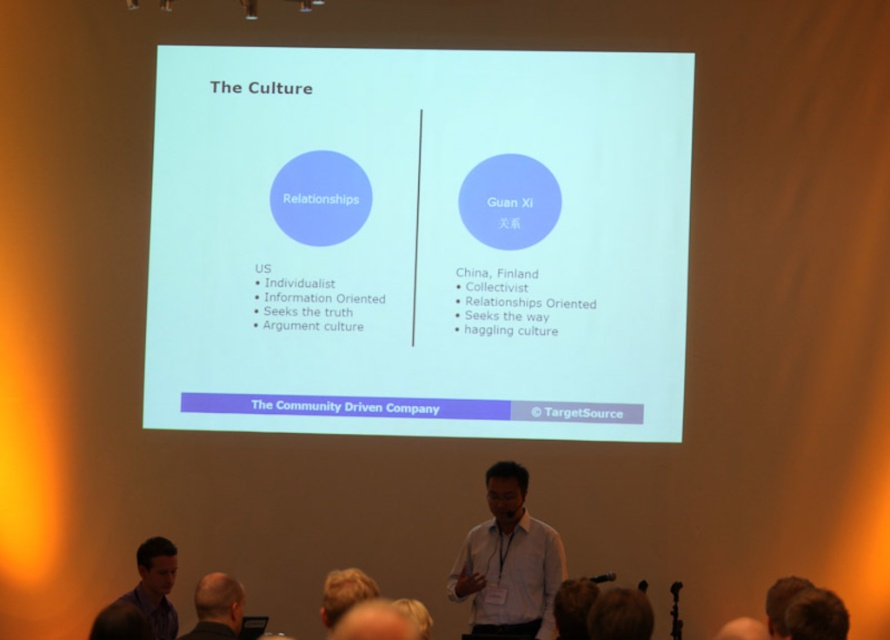
Question: Is white matte shirt at center to the right of dark gray hair at lower center from the viewer's perspective?

Choices:
 (A) yes
 (B) no

Answer: (A)

Question: Which object is farther from the camera taking this photo?

Choices:
 (A) blonde hair at upper center
 (B) white matte projector screen at center

Answer: (B)

Question: Is matte black shirt at lower left below dark gray hair at lower center?

Choices:
 (A) yes
 (B) no

Answer: (A)

Question: Which object appears closest to the camera in this image?

Choices:
 (A) dark gray hair at lower center
 (B) matte black shirt at lower left
 (C) white matte shirt at center
 (D) blonde hair at upper center

Answer: (A)

Question: Which point appears closest to the camera in this image?

Choices:
 (A) (567, 122)
 (B) (496, 474)
 (C) (193, 634)

Answer: (C)

Question: Does matte black shirt at lower left have a larger size compared to dark gray hair at lower center?

Choices:
 (A) yes
 (B) no

Answer: (A)